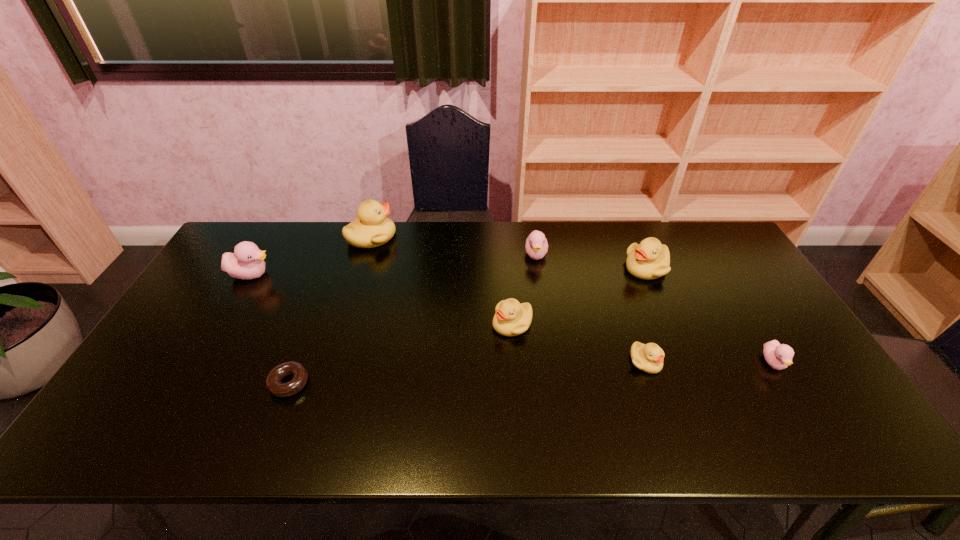
You are a GUI agent. You are given a task and a screenshot of the screen. Output one action in this format:
    pyautogui.click(x=<x>, y=<y>)
    Task: Click on the vacant area situated on the front-facing side of the third nearest duckling
    The width and height of the screenshot is (960, 540).
    Given the screenshot: What is the action you would take?
    pyautogui.click(x=379, y=324)

In order to click on vacant region located 0.340m on the front-facing side of the third nearest duckling in this screenshot , I will do `click(372, 324)`.

I want to click on vacant region located on the front-facing side of the third nearest duckling, so click(x=415, y=324).

Where is `free space located on the front-facing side of the nearest pink duckling`? Image resolution: width=960 pixels, height=540 pixels. free space located on the front-facing side of the nearest pink duckling is located at coordinates (811, 424).

Locate an element on the screen. Image resolution: width=960 pixels, height=540 pixels. vacant space situated on the front-facing side of the nearest yellow duckling is located at coordinates point(665,418).

In order to click on free spot located on the right of the shortest object in this screenshot , I will do `click(369, 383)`.

Locate an element on the screen. Image resolution: width=960 pixels, height=540 pixels. object that is positioned at the left edge is located at coordinates (247, 262).

Where is `object that is positioned at the right edge`? The image size is (960, 540). object that is positioned at the right edge is located at coordinates (779, 356).

Where is `object situated at the far left corner`? The height and width of the screenshot is (540, 960). object situated at the far left corner is located at coordinates (247, 262).

Where is `vacant area at the far edge`? The height and width of the screenshot is (540, 960). vacant area at the far edge is located at coordinates coord(423,248).